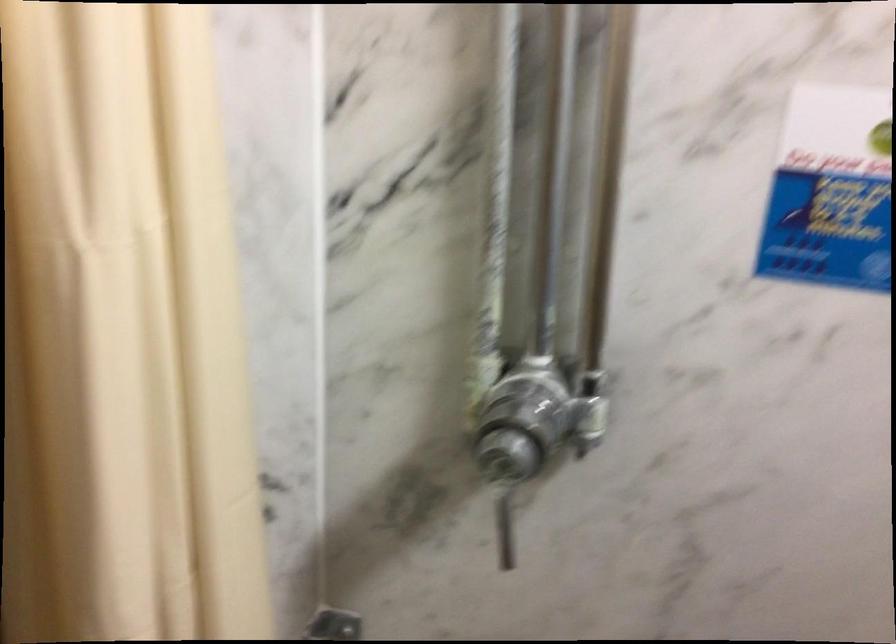
The height and width of the screenshot is (644, 896). I want to click on metal valve lever, so click(504, 522).